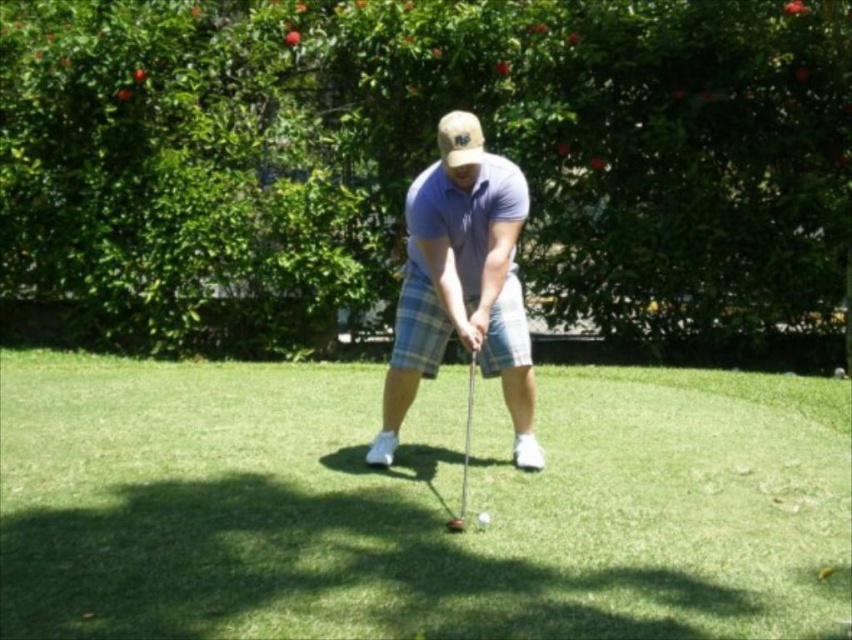
Who is shorter, metallic silver golf club at center or shiny silver golf ball at center?

shiny silver golf ball at center

Is metallic silver golf club at center thinner than shiny silver golf ball at center?

Correct, metallic silver golf club at center's width is less than shiny silver golf ball at center's.

Where is `metallic silver golf club at center`? metallic silver golf club at center is located at coordinates (465, 452).

You are a GUI agent. You are given a task and a screenshot of the screen. Output one action in this format:
    pyautogui.click(x=<x>, y=<y>)
    Task: Click on the metallic silver golf club at center
    The width and height of the screenshot is (852, 640).
    Given the screenshot: What is the action you would take?
    pyautogui.click(x=465, y=452)

Does point (381, 596) come in front of point (481, 520)?

Yes, point (381, 596) is in front of point (481, 520).

Can you confirm if green grass at center is smaller than shiny silver golf ball at center?

Actually, green grass at center might be larger than shiny silver golf ball at center.

Locate an element on the screen. The width and height of the screenshot is (852, 640). green grass at center is located at coordinates (416, 504).

Find the location of a particular element. The image size is (852, 640). green grass at center is located at coordinates (416, 504).

Does matte blue shirt at center come behind metallic silver golf club at center?

No, matte blue shirt at center is closer to the viewer.

Can you confirm if matte blue shirt at center is smaller than metallic silver golf club at center?

Incorrect, matte blue shirt at center is not smaller in size than metallic silver golf club at center.

The width and height of the screenshot is (852, 640). What do you see at coordinates (461, 284) in the screenshot? I see `matte blue shirt at center` at bounding box center [461, 284].

Locate an element on the screen. matte blue shirt at center is located at coordinates (461, 284).